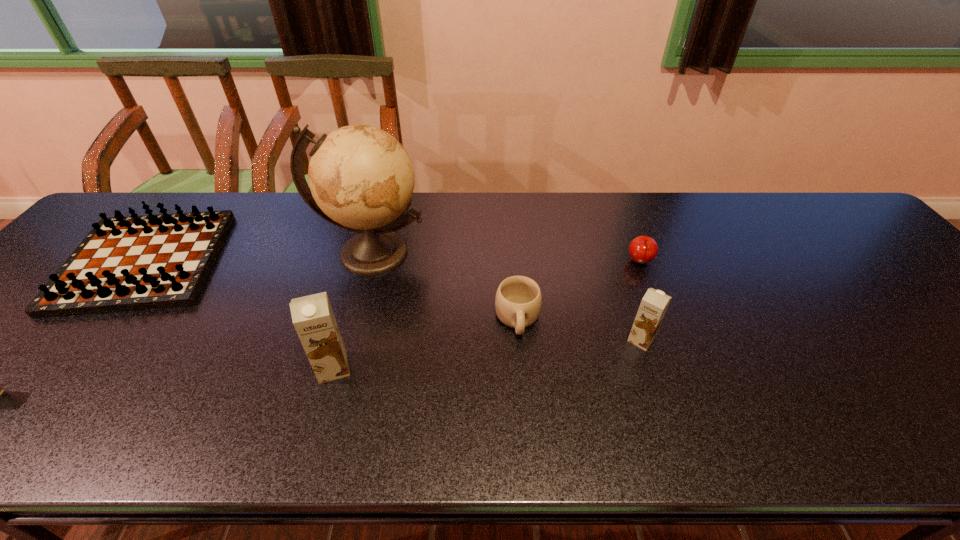
The width and height of the screenshot is (960, 540). What are the coordinates of `free space located 0.160m on the front of the leftmost object` in the screenshot? It's located at (52, 376).

At what (x,y) coordinates should I click in order to perform the action: click on vacant area situated 0.290m on the front-facing side of the globe. Please return your answer as a coordinate pair (x, y). Looking at the image, I should click on (337, 382).

The image size is (960, 540). What are the coordinates of `vacant region located 0.390m on the right of the cherry` in the screenshot? It's located at (799, 262).

This screenshot has height=540, width=960. What are the coordinates of `vacant area situated 0.080m on the side of the fourth object from left to right with the handle` in the screenshot? It's located at (522, 372).

The width and height of the screenshot is (960, 540). What are the coordinates of `chessboard that is at the far edge` in the screenshot? It's located at (130, 263).

You are a GUI agent. You are given a task and a screenshot of the screen. Output one action in this format:
    pyautogui.click(x=<x>, y=<y>)
    Task: Click on the globe that is at the far edge
    The width and height of the screenshot is (960, 540).
    Given the screenshot: What is the action you would take?
    pyautogui.click(x=361, y=179)

What are the coordinates of `object that is positioned at the near edge` in the screenshot? It's located at (313, 318).

I want to click on object situated at the left edge, so click(x=130, y=263).

Find the location of `object at the far left corner`. object at the far left corner is located at coordinates (130, 263).

In the image, there is a desktop. What are the coordinates of `vacant space at the far edge` in the screenshot? It's located at (776, 206).